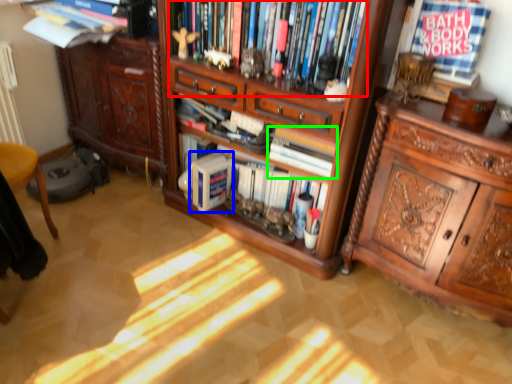
Question: Considering the real-world distances, which object is farthest from book (highlighted by a red box)? book (highlighted by a blue box) or book (highlighted by a green box)?

Choices:
 (A) book
 (B) book

Answer: (A)